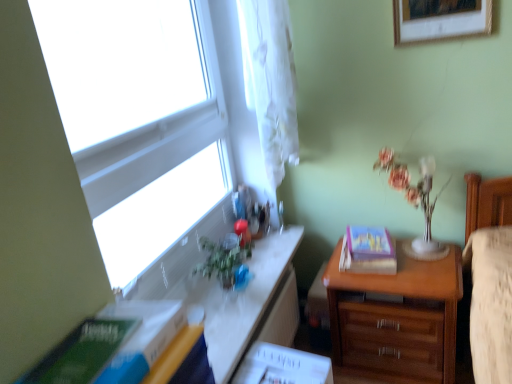
Where is `blank area beneath translucent glass vase at upper right (from a real-world perspective)`? The width and height of the screenshot is (512, 384). blank area beneath translucent glass vase at upper right (from a real-world perspective) is located at coordinates (418, 244).